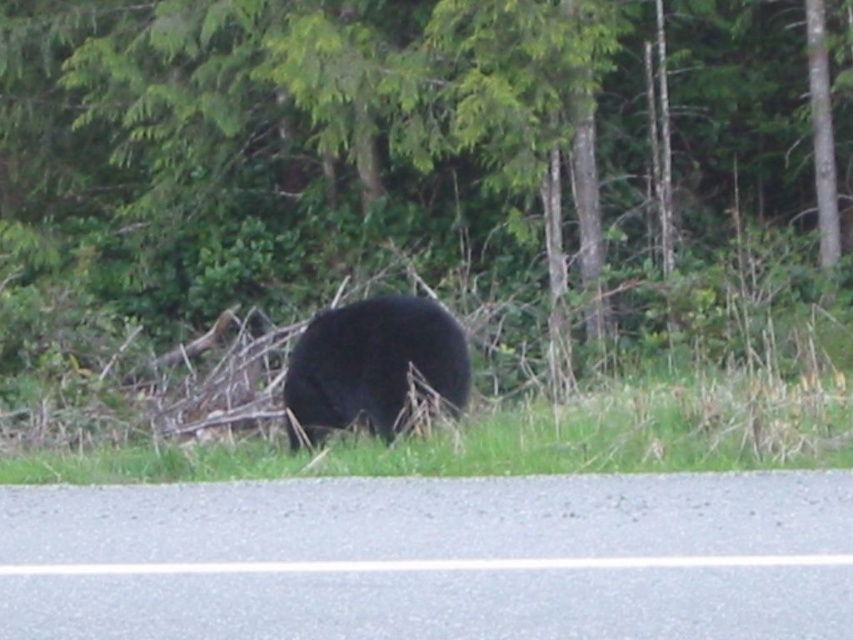
Who is positioned more to the left, green leafy tree at center or black furry bear at center?

black furry bear at center is more to the left.

Is green leafy tree at center positioned behind black furry bear at center?

Yes, it is.

Between point (849, 214) and point (419, 362), which one is positioned behind?

The point (849, 214) is more distant.

Locate an element on the screen. green leafy tree at center is located at coordinates (407, 141).